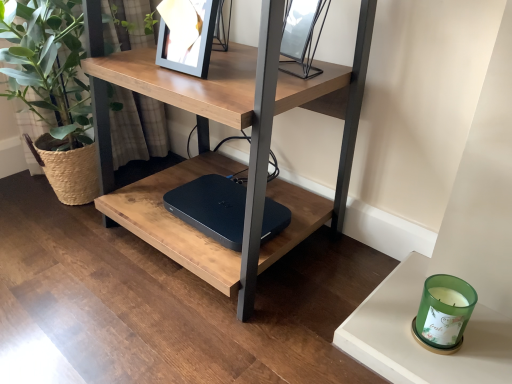
The image size is (512, 384). What are the coordinates of `free point below green woven basket at left (from a real-world perspective)` in the screenshot? It's located at (61, 213).